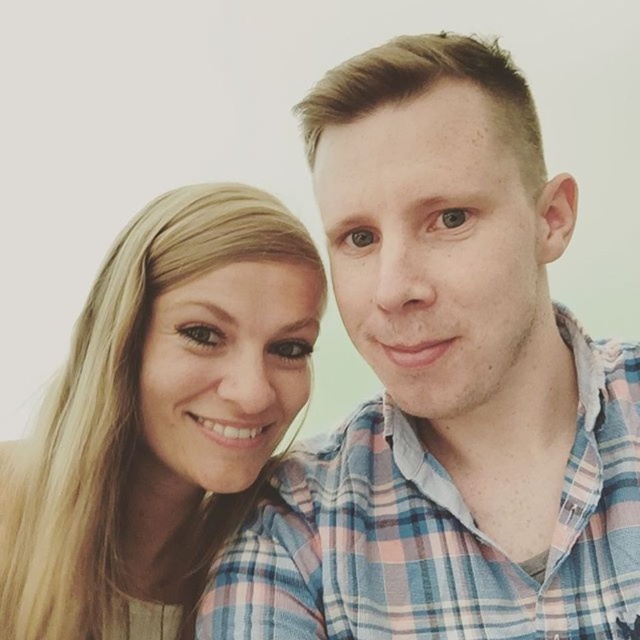
You are taking a photo of two people and notice the plaid shirt at center and the blonde hair at upper left. Which object is closer to the camera?

The plaid shirt at center is closer to the camera because it is in front of the blonde hair at upper left.

What are the coordinates of the plaid shirt at center?

The plaid shirt at center is located at point (x=445, y=385).

You are a photographer adjusting the framing of a portrait. You need to ensure that both the plaid shirt at center and the blonde hair at upper left are clearly visible. Based on their sizes, which object should you prioritize keeping within the frame to maintain balance?

The plaid shirt at center has a larger size compared to the blonde hair at upper left, so you should prioritize keeping the plaid shirt at center within the frame to maintain balance.